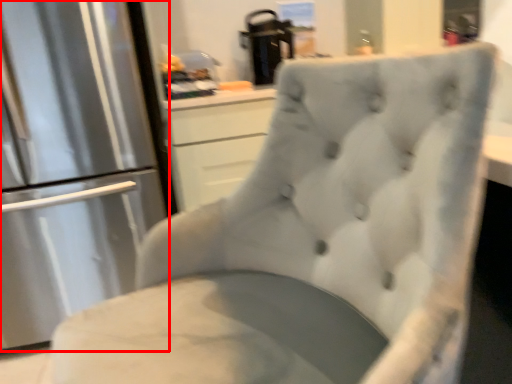
Question: Considering the relative positions of refrigerator (annotated by the red box) and appliance in the image provided, where is refrigerator (annotated by the red box) located with respect to the staircase?

Choices:
 (A) left
 (B) right

Answer: (A)